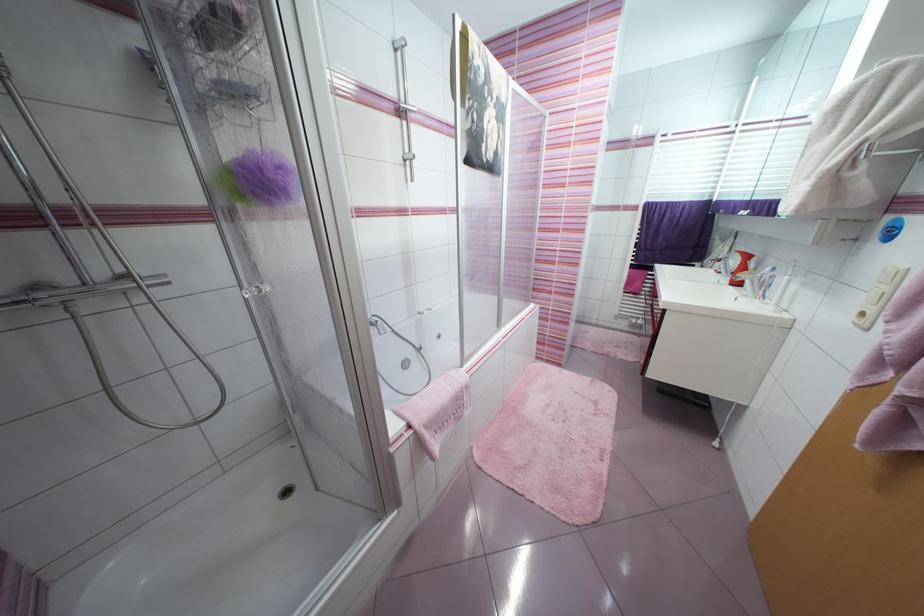
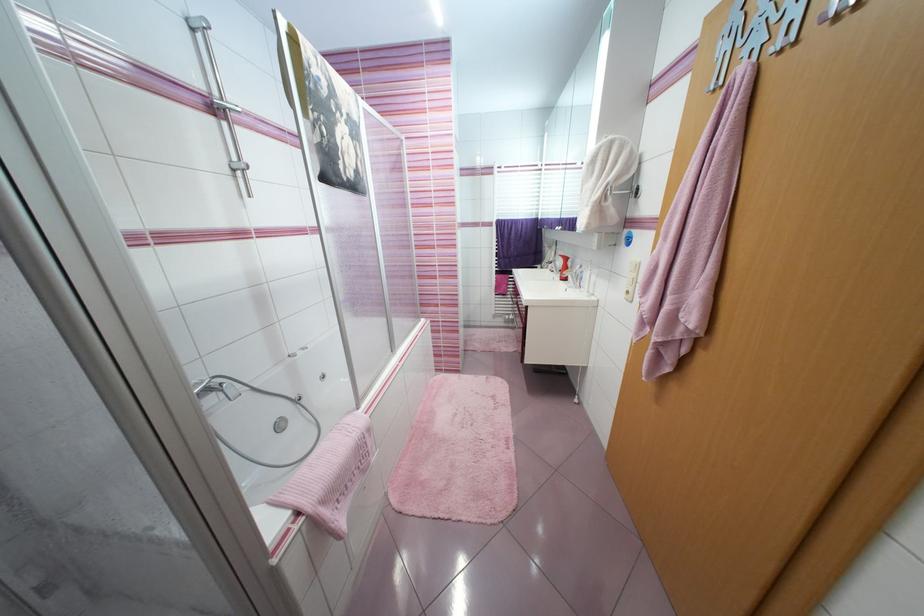
Where in the second image is the point corresponding to point 869,315 from the first image?

(633, 293)